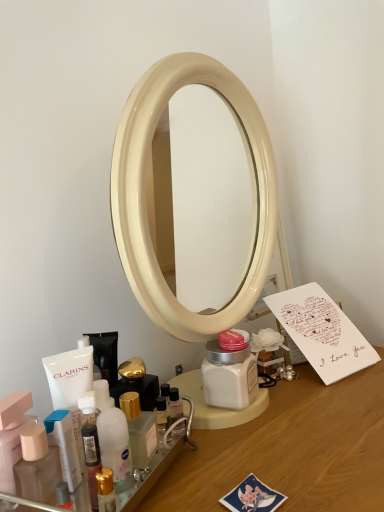
This screenshot has width=384, height=512. What do you see at coordinates (37, 466) in the screenshot?
I see `matte plastic bottle at lower left, which is the second toiletry from left to right` at bounding box center [37, 466].

Measure the distance between point (164, 450) and camera.

The depth of point (164, 450) is 56.40 centimeters.

You are a GUI agent. You are given a task and a screenshot of the screen. Output one action in this format:
    pyautogui.click(x=<x>, y=<y>)
    Task: Click on the translucent plastic bottle at lower left, which appears as the first toiletry when viewed from the right
    
    Given the screenshot: What is the action you would take?
    pyautogui.click(x=146, y=475)

What do you see at coordinates (293, 449) in the screenshot? Image resolution: width=384 pixels, height=512 pixels. I see `wooden desk at center` at bounding box center [293, 449].

Locate an element on the screen. This screenshot has height=512, width=384. matte plastic bottle at lower left, which is counted as the second toiletry, starting from the right is located at coordinates (37, 466).

Where is `the 2nd toiletry in front of the white paper card at right, counting from the anchor's position`? The image size is (384, 512). the 2nd toiletry in front of the white paper card at right, counting from the anchor's position is located at coordinates (37, 466).

Between white paper card at right and matte plastic bottle at lower left, which is the second toiletry from left to right, which one is positioned behind?

white paper card at right is further away from the camera.

You are a GUI agent. You are given a task and a screenshot of the screen. Output one action in this format:
    pyautogui.click(x=<x>, y=<y>)
    Task: Click on the desk in front of the matte pink container at lower left, placed as the 3th toiletry when sorted from right to left
    The height and width of the screenshot is (512, 384).
    Given the screenshot: What is the action you would take?
    pyautogui.click(x=293, y=449)

From a real-world perspective, is matte pink container at lower left, marked as the 1th toiletry in a left-to-right arrangement, above or below wooden desk at center?

matte pink container at lower left, marked as the 1th toiletry in a left-to-right arrangement, is situated higher than wooden desk at center in the real world.

Is wooden desk at center at the back of matte pink container at lower left, placed as the 3th toiletry when sorted from right to left?

No, matte pink container at lower left, placed as the 3th toiletry when sorted from right to left,'s orientation is not away from wooden desk at center.

Is there a large distance between matte pink container at lower left, placed as the 3th toiletry when sorted from right to left, and wooden desk at center?

No, there isn't a large distance between matte pink container at lower left, placed as the 3th toiletry when sorted from right to left, and wooden desk at center.

Is matte pink container at lower left, marked as the 1th toiletry in a left-to-right arrangement, positioned before white paper card at right?

Yes, it is.

Based on the photo, is matte pink container at lower left, marked as the 1th toiletry in a left-to-right arrangement, aimed at white paper card at right?

No, matte pink container at lower left, marked as the 1th toiletry in a left-to-right arrangement, is not facing towards white paper card at right.

Is matte pink container at lower left, placed as the 3th toiletry when sorted from right to left, wider than white paper card at right?

Incorrect, the width of matte pink container at lower left, placed as the 3th toiletry when sorted from right to left, does not surpass that of white paper card at right.

From the image's perspective, would you say matte pink container at lower left, marked as the 1th toiletry in a left-to-right arrangement, is shown under white paper card at right?

Correct, matte pink container at lower left, marked as the 1th toiletry in a left-to-right arrangement, appears lower than white paper card at right in the image.

Considering the sizes of matte pink container at lower left, placed as the 3th toiletry when sorted from right to left, and translucent plastic bottle at lower left, acting as the 3th toiletry starting from the left, in the image, is matte pink container at lower left, placed as the 3th toiletry when sorted from right to left, bigger or smaller than translucent plastic bottle at lower left, acting as the 3th toiletry starting from the left,?

In the image, matte pink container at lower left, placed as the 3th toiletry when sorted from right to left, appears to be smaller than translucent plastic bottle at lower left, acting as the 3th toiletry starting from the left.

Is point (17, 442) farther from viewer compared to point (126, 495)?

Yes, it is.

Consider the image. Does matte pink container at lower left, placed as the 3th toiletry when sorted from right to left, turn towards translucent plastic bottle at lower left, which appears as the first toiletry when viewed from the right?

No.

Which of these two, matte pink container at lower left, marked as the 1th toiletry in a left-to-right arrangement, or translucent plastic bottle at lower left, which appears as the first toiletry when viewed from the right, stands taller?

With more height is matte pink container at lower left, marked as the 1th toiletry in a left-to-right arrangement.

Is wooden desk at center not near matte pink container at lower left, marked as the 1th toiletry in a left-to-right arrangement?

wooden desk at center is actually quite close to matte pink container at lower left, marked as the 1th toiletry in a left-to-right arrangement.

From a real-world perspective, is wooden desk at center physically located above or below matte pink container at lower left, placed as the 3th toiletry when sorted from right to left?

wooden desk at center is situated lower than matte pink container at lower left, placed as the 3th toiletry when sorted from right to left, in the real world.

Which object is thinner, wooden desk at center or matte pink container at lower left, placed as the 3th toiletry when sorted from right to left?

Thinner between the two is matte pink container at lower left, placed as the 3th toiletry when sorted from right to left.

There is a wooden desk at center. Where is `the 3rd toiletry above it (from a real-world perspective)`? The height and width of the screenshot is (512, 384). the 3rd toiletry above it (from a real-world perspective) is located at coordinates (12, 434).

Considering the points (8, 431) and (32, 447), which point is in front, point (8, 431) or point (32, 447)?

Positioned in front is point (32, 447).

From the picture: From the image's perspective, is matte pink container at lower left, placed as the 3th toiletry when sorted from right to left, positioned above or below matte plastic bottle at lower left, which is the second toiletry from left to right?

From the image's perspective, matte pink container at lower left, placed as the 3th toiletry when sorted from right to left, appears above matte plastic bottle at lower left, which is the second toiletry from left to right.

Looking at this image, looking at their sizes, would you say matte pink container at lower left, marked as the 1th toiletry in a left-to-right arrangement, is wider or thinner than matte plastic bottle at lower left, which is the second toiletry from left to right?

In the image, matte pink container at lower left, marked as the 1th toiletry in a left-to-right arrangement, appears to be wider than matte plastic bottle at lower left, which is the second toiletry from left to right.

Is matte pink container at lower left, placed as the 3th toiletry when sorted from right to left, behind matte plastic bottle at lower left, which is the second toiletry from left to right?

Yes, the depth of matte pink container at lower left, placed as the 3th toiletry when sorted from right to left, is greater than that of matte plastic bottle at lower left, which is the second toiletry from left to right.

Is matte plastic bottle at lower left, which is the second toiletry from left to right, inside wooden desk at center?

Actually, matte plastic bottle at lower left, which is the second toiletry from left to right, is outside wooden desk at center.

Does wooden desk at center appear on the right side of matte plastic bottle at lower left, which is counted as the second toiletry, starting from the right?

Yes.

From the image's perspective, is wooden desk at center below matte plastic bottle at lower left, which is counted as the second toiletry, starting from the right?

Yes.

Who is taller, wooden desk at center or matte plastic bottle at lower left, which is counted as the second toiletry, starting from the right?

Standing taller between the two is wooden desk at center.

Find the location of a particular element. This screenshot has height=512, width=384. postcard that appears behind the matte plastic bottle at lower left, which is counted as the second toiletry, starting from the right is located at coordinates pyautogui.click(x=322, y=332).

Locate an element on the screen. This screenshot has width=384, height=512. desk below the matte pink container at lower left, marked as the 1th toiletry in a left-to-right arrangement (from a real-world perspective) is located at coordinates (293, 449).

Based on their spatial positions, is translucent plastic bottle at lower left, which appears as the first toiletry when viewed from the right, or white paper card at right closer to wooden desk at center?

translucent plastic bottle at lower left, which appears as the first toiletry when viewed from the right, is closer to wooden desk at center.

Consider the image. When comparing their distances from matte plastic bottle at lower left, which is the second toiletry from left to right, does white paper card at right or wooden desk at center seem further?

white paper card at right.

Estimate the real-world distances between objects in this image. Which object is further from matte plastic bottle at lower left, which is counted as the second toiletry, starting from the right, wooden desk at center or white paper card at right?

Among the two, white paper card at right is located further to matte plastic bottle at lower left, which is counted as the second toiletry, starting from the right.

Estimate the real-world distances between objects in this image. Which object is further from matte plastic bottle at lower left, which is the second toiletry from left to right, matte pink container at lower left, marked as the 1th toiletry in a left-to-right arrangement, or translucent plastic bottle at lower left, acting as the 3th toiletry starting from the left?

translucent plastic bottle at lower left, acting as the 3th toiletry starting from the left, is positioned further to the anchor matte plastic bottle at lower left, which is the second toiletry from left to right.

Which object lies nearer to the anchor point translucent plastic bottle at lower left, which appears as the first toiletry when viewed from the right, white paper card at right or wooden desk at center?

wooden desk at center.

When comparing their distances from translucent plastic bottle at lower left, acting as the 3th toiletry starting from the left, does matte pink container at lower left, placed as the 3th toiletry when sorted from right to left, or white paper card at right seem closer?

matte pink container at lower left, placed as the 3th toiletry when sorted from right to left.

From the image, which object appears to be nearer to white paper card at right, matte pink container at lower left, marked as the 1th toiletry in a left-to-right arrangement, or wooden desk at center?

Among the two, wooden desk at center is located nearer to white paper card at right.

From the image, which object appears to be nearer to white paper card at right, matte plastic bottle at lower left, which is the second toiletry from left to right, or translucent plastic bottle at lower left, acting as the 3th toiletry starting from the left?

translucent plastic bottle at lower left, acting as the 3th toiletry starting from the left, is positioned closer to the anchor white paper card at right.

Where is `desk between matte plastic bottle at lower left, which is the second toiletry from left to right, and white paper card at right, in the horizontal direction`? desk between matte plastic bottle at lower left, which is the second toiletry from left to right, and white paper card at right, in the horizontal direction is located at coordinates (293, 449).

Find the location of a particular element. The image size is (384, 512). toiletry between translucent plastic bottle at lower left, which appears as the first toiletry when viewed from the right, and matte pink container at lower left, marked as the 1th toiletry in a left-to-right arrangement, in the front-back direction is located at coordinates (37, 466).

Where is `toiletry located between matte plastic bottle at lower left, which is the second toiletry from left to right, and wooden desk at center in the left-right direction`? The image size is (384, 512). toiletry located between matte plastic bottle at lower left, which is the second toiletry from left to right, and wooden desk at center in the left-right direction is located at coordinates 146,475.

The height and width of the screenshot is (512, 384). I want to click on desk situated between matte pink container at lower left, placed as the 3th toiletry when sorted from right to left, and white paper card at right from left to right, so click(x=293, y=449).